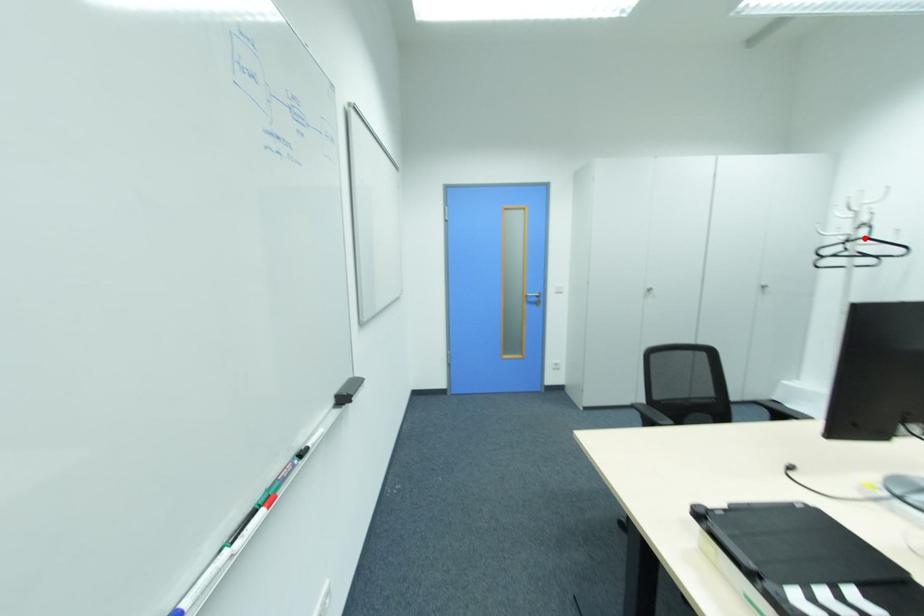
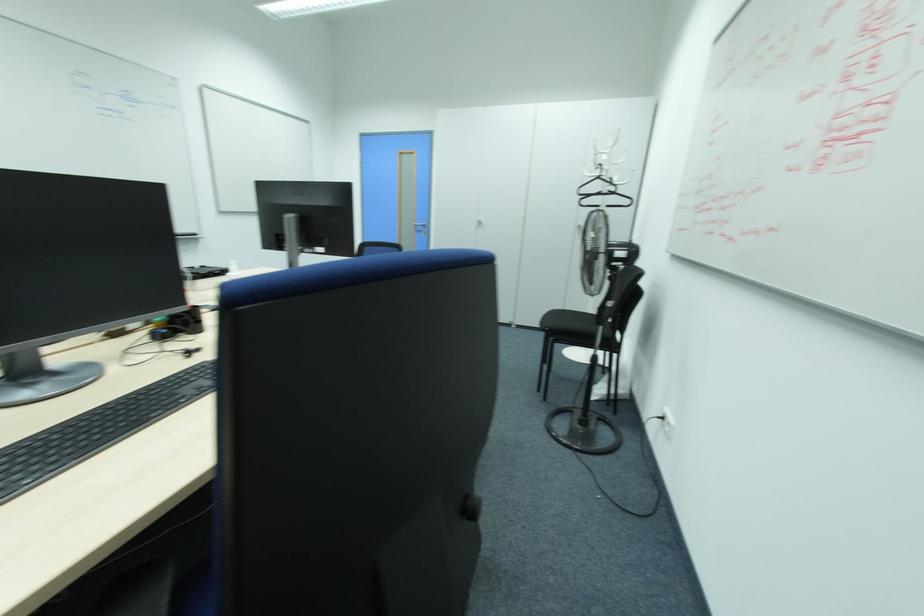
The point at the highlighted location is marked in the first image. Where is the corresponding point in the second image?

(599, 177)